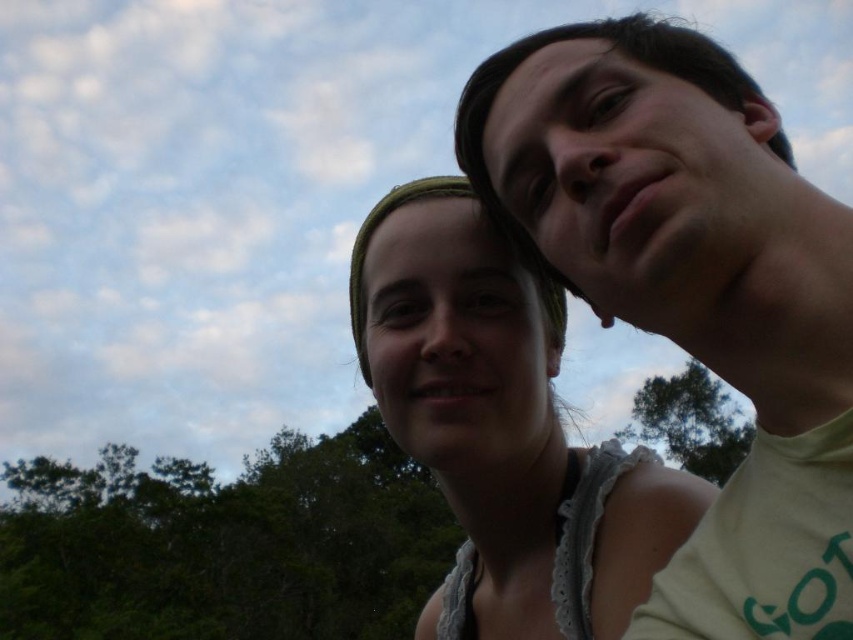
Question: Does matte white shirt at center have a greater width compared to green leafy trees at lower left?

Choices:
 (A) yes
 (B) no

Answer: (B)

Question: Which point is farther to the camera?

Choices:
 (A) matte green t-shirt at upper right
 (B) green leafy tree at upper right
 (C) green leafy trees at lower left

Answer: (B)

Question: Which of these objects is positioned farthest from the matte white shirt at center?

Choices:
 (A) green leafy trees at lower left
 (B) matte green t-shirt at upper right

Answer: (A)

Question: Which object is positioned farthest from the green leafy trees at lower left?

Choices:
 (A) matte white shirt at center
 (B) green leafy tree at upper right
 (C) matte green t-shirt at upper right

Answer: (A)

Question: Does green leafy trees at lower left appear on the left side of green leafy tree at upper right?

Choices:
 (A) no
 (B) yes

Answer: (B)

Question: Is matte green t-shirt at upper right below green leafy trees at lower left?

Choices:
 (A) yes
 (B) no

Answer: (B)